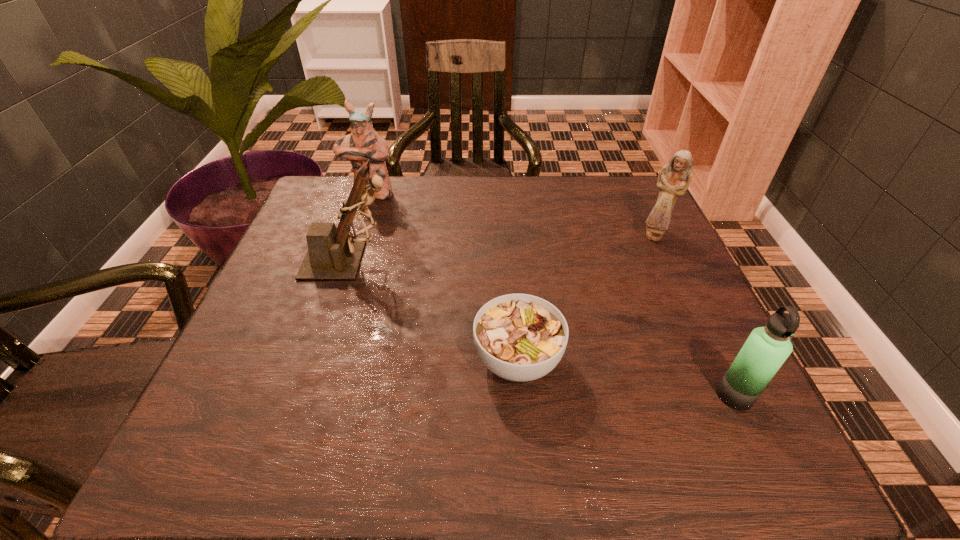
Identify the location of free spot at the near right corner of the desktop. Image resolution: width=960 pixels, height=540 pixels. (732, 458).

Locate an element on the screen. vacant space that is in between the third object from left to right and the rightmost figurine is located at coordinates (586, 298).

Identify the location of empty space that is in between the farthest object and the third object from right to left. The width and height of the screenshot is (960, 540). (444, 277).

What are the coordinates of `object that is the fourth closest to the rightmost figurine` in the screenshot? It's located at (364, 143).

At what (x,y) coordinates should I click in order to perform the action: click on object that is the fourth closest to the rightmost figurine. Please return your answer as a coordinate pair (x, y). Image resolution: width=960 pixels, height=540 pixels. Looking at the image, I should click on (364, 143).

Locate which figurine is the second closest to the rightmost figurine. Please provide its 2D coordinates. Your answer should be formatted as a tuple, i.e. [(x, y)], where the tuple contains the x and y coordinates of a point satisfying the conditions above.

[(364, 143)]

Where is `figurine that stands as the third closest to the thermos bottle`? figurine that stands as the third closest to the thermos bottle is located at coordinates [364, 143].